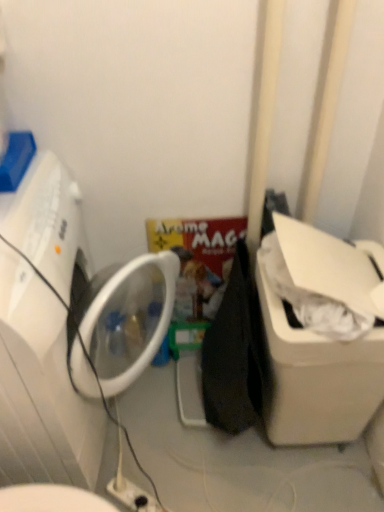
Image resolution: width=384 pixels, height=512 pixels. What do you see at coordinates (316, 378) in the screenshot?
I see `white plastic water cooler at right` at bounding box center [316, 378].

At what (x,y) coordinates should I click in order to perform the action: click on white plastic washing machine at left. Please return your answer as a coordinate pair (x, y). Looking at the image, I should click on (41, 388).

Locate an element on the screen. This screenshot has width=384, height=512. white plastic water cooler at right is located at coordinates (316, 378).

Does white plastic washing machine at left turn towards white plastic electric outlet at lower center?

No, white plastic washing machine at left does not turn towards white plastic electric outlet at lower center.

Considering the positions of point (10, 346) and point (127, 505), is point (10, 346) closer or farther from the camera than point (127, 505)?

Point (10, 346) is positioned closer to the camera compared to point (127, 505).

Can you see white plastic washing machine at left touching white plastic electric outlet at lower center?

white plastic washing machine at left and white plastic electric outlet at lower center are clearly separated.

Which of these two, white plastic washing machine at left or white plastic electric outlet at lower center, is bigger?

white plastic washing machine at left.

Is white plastic water cooler at right shorter than white plastic washing machine at left?

Indeed, white plastic water cooler at right has a lesser height compared to white plastic washing machine at left.

Does point (258, 273) appear closer or farther from the camera than point (48, 479)?

Point (258, 273) is closer to the camera than point (48, 479).

You are a GUI agent. You are given a task and a screenshot of the screen. Output one action in this format:
    pyautogui.click(x=<x>, y=<y>)
    Task: Click on the water cooler located on the right of white plastic washing machine at left
    
    Given the screenshot: What is the action you would take?
    pyautogui.click(x=316, y=378)

Looking at the image, does white plastic water cooler at right seem bigger or smaller compared to white plastic washing machine at left?

Clearly, white plastic water cooler at right is smaller in size than white plastic washing machine at left.

From the image's perspective, would you say white plastic electric outlet at lower center is positioned over white plastic washing machine at left?

Incorrect, from the image's perspective, white plastic electric outlet at lower center is lower than white plastic washing machine at left.

Looking at this image, from a real-world perspective, is white plastic electric outlet at lower center below white plastic washing machine at left?

Indeed, from a real-world perspective, white plastic electric outlet at lower center is positioned beneath white plastic washing machine at left.

Between white plastic electric outlet at lower center and white plastic washing machine at left, which one is positioned behind?

white plastic electric outlet at lower center is further from the camera.

How many degrees apart are the facing directions of white plastic electric outlet at lower center and white plastic washing machine at left?

38.1 degrees separate the facing orientations of white plastic electric outlet at lower center and white plastic washing machine at left.

Is white plastic washing machine at left situated inside white plastic water cooler at right or outside?

white plastic washing machine at left lies outside white plastic water cooler at right.

In the scene shown: From a real-world perspective, between white plastic washing machine at left and white plastic water cooler at right, who is vertically lower?

white plastic water cooler at right.

Considering the relative positions of white plastic water cooler at right and white plastic electric outlet at lower center in the image provided, is white plastic water cooler at right to the left or to the right of white plastic electric outlet at lower center?

white plastic water cooler at right is to the right of white plastic electric outlet at lower center.

Is white plastic water cooler at right looking in the opposite direction of white plastic electric outlet at lower center?

white plastic water cooler at right does not have its back to white plastic electric outlet at lower center.

Is white plastic water cooler at right in front of white plastic electric outlet at lower center?

Yes, white plastic water cooler at right is in front of white plastic electric outlet at lower center.

Considering the relative sizes of white plastic electric outlet at lower center and white plastic water cooler at right in the image provided, is white plastic electric outlet at lower center wider than white plastic water cooler at right?

No, white plastic electric outlet at lower center is not wider than white plastic water cooler at right.

Looking at this image, is white plastic electric outlet at lower center taller than white plastic water cooler at right?

In fact, white plastic electric outlet at lower center may be shorter than white plastic water cooler at right.

Is white plastic electric outlet at lower center looking in the opposite direction of white plastic water cooler at right?

No.

Which is behind, point (121, 487) or point (304, 377)?

Point (121, 487)

Locate an element on the screen. electric outlet that appears behind the white plastic washing machine at left is located at coordinates (132, 495).

You are a GUI agent. You are given a task and a screenshot of the screen. Output one action in this format:
    pyautogui.click(x=<x>, y=<y>)
    Task: Click on the washing machine above the white plastic water cooler at right (from the image's perspective)
    
    Given the screenshot: What is the action you would take?
    pyautogui.click(x=41, y=388)

Which object lies nearer to the anchor point white plastic water cooler at right, white plastic electric outlet at lower center or white plastic washing machine at left?

The object closer to white plastic water cooler at right is white plastic electric outlet at lower center.

From the image, which object appears to be nearer to white plastic washing machine at left, white plastic electric outlet at lower center or white plastic water cooler at right?

The object closer to white plastic washing machine at left is white plastic electric outlet at lower center.

Looking at the image, which one is located further to white plastic water cooler at right, white plastic washing machine at left or white plastic electric outlet at lower center?

Among the two, white plastic washing machine at left is located further to white plastic water cooler at right.

Considering their positions, is white plastic washing machine at left positioned closer to white plastic electric outlet at lower center than white plastic water cooler at right?

The object closer to white plastic electric outlet at lower center is white plastic washing machine at left.

Based on their spatial positions, is white plastic water cooler at right or white plastic electric outlet at lower center closer to white plastic washing machine at left?

white plastic electric outlet at lower center is positioned closer to the anchor white plastic washing machine at left.

Which object lies further to the anchor point white plastic electric outlet at lower center, white plastic water cooler at right or white plastic washing machine at left?

Based on the image, white plastic water cooler at right appears to be further to white plastic electric outlet at lower center.

What are the coordinates of `electric outlet located between white plastic washing machine at left and white plastic water cooler at right in the left-right direction` in the screenshot? It's located at (132, 495).